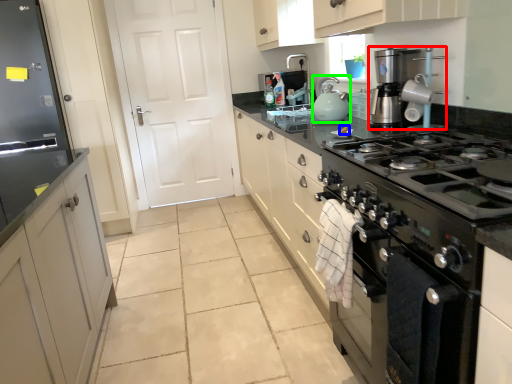
Question: Considering the real-world distances, which object is closest to home appliance (highlighted by a red box)? food (highlighted by a blue box) or kitchen appliance (highlighted by a green box).

Choices:
 (A) food
 (B) kitchen appliance

Answer: (B)